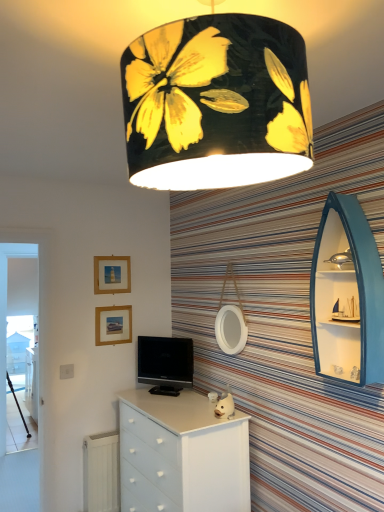
Find the location of a particular element. The height and width of the screenshot is (512, 384). matte gold picture frame at upper left, placed as the 2th picture frame when sorted from bottom to top is located at coordinates (112, 274).

Identify the location of teal wood boat-shaped shelf at right. Image resolution: width=384 pixels, height=512 pixels. point(347,295).

Describe the element at coordinates (113, 325) in the screenshot. I see `wooden picture frame at upper left, positioned as the 1th picture frame in bottom-to-top order` at that location.

You are a GUI agent. You are given a task and a screenshot of the screen. Output one action in this format:
    pyautogui.click(x=<x>, y=<y>)
    Task: Click on the matte gold picture frame at upper left, placed as the 2th picture frame when sorted from bottom to top
    The height and width of the screenshot is (512, 384).
    Given the screenshot: What is the action you would take?
    pyautogui.click(x=112, y=274)

Locate an element on the screen. This screenshot has height=512, width=384. shelf in front of the wooden picture frame at upper left, positioned as the 1th picture frame in bottom-to-top order is located at coordinates (347, 295).

Based on the photo, between wooden picture frame at upper left, which is counted as the second picture frame, starting from the top, and teal wood boat-shaped shelf at right, which one has more height?

teal wood boat-shaped shelf at right.

From the picture: Can you tell me how much wooden picture frame at upper left, which is counted as the second picture frame, starting from the top, and teal wood boat-shaped shelf at right differ in facing direction?

There is a 90.2-degree angle between the facing directions of wooden picture frame at upper left, which is counted as the second picture frame, starting from the top, and teal wood boat-shaped shelf at right.

Are wooden picture frame at upper left, which is counted as the second picture frame, starting from the top, and teal wood boat-shaped shelf at right beside each other?

No, wooden picture frame at upper left, which is counted as the second picture frame, starting from the top, is not with teal wood boat-shaped shelf at right.

Find the location of a particular element. radiator behind the black fabric lampshade at upper center is located at coordinates (101, 472).

Which is more distant, (263,151) or (84,490)?

The point (84,490) is more distant.

What's the angular difference between black fabric lampshade at upper center and white matte radiator at lower left's facing directions?

They differ by 180 degrees in their facing directions.

Is black fabric lampshade at upper center taller than white matte radiator at lower left?

Incorrect, the height of black fabric lampshade at upper center is not larger of that of white matte radiator at lower left.

Who is taller, white matte mirror at center or matte gold picture frame at upper left, placed as the 2th picture frame when sorted from bottom to top?

white matte mirror at center is taller.

From a real-world perspective, which object rests below the other?

→ white matte mirror at center.

Is white matte mirror at center thinner than matte gold picture frame at upper left, placed as the 2th picture frame when sorted from bottom to top?

In fact, white matte mirror at center might be wider than matte gold picture frame at upper left, placed as the 2th picture frame when sorted from bottom to top.

Would you say matte gold picture frame at upper left, placed as the 2th picture frame when sorted from bottom to top, is part of white matte mirror at center's contents?

No, matte gold picture frame at upper left, placed as the 2th picture frame when sorted from bottom to top, is not surrounded by white matte mirror at center.

Considering the sizes of black glossy television at center and black fabric lampshade at upper center in the image, is black glossy television at center wider or thinner than black fabric lampshade at upper center?

In the image, black glossy television at center appears to be more narrow than black fabric lampshade at upper center.

Is black glossy television at center outside of black fabric lampshade at upper center?

Absolutely, black glossy television at center is external to black fabric lampshade at upper center.

Based on the photo, what's the angular difference between black glossy television at center and black fabric lampshade at upper center's facing directions?

There is a 129-degree angle between the facing directions of black glossy television at center and black fabric lampshade at upper center.

Does point (169, 371) lie in front of point (181, 151)?

No.

From a real-world perspective, is wooden picture frame at upper left, positioned as the 1th picture frame in bottom-to-top order, positioned under black glossy television at center based on gravity?

Actually, wooden picture frame at upper left, positioned as the 1th picture frame in bottom-to-top order, is physically above black glossy television at center in the real world.

Considering the positions of point (129, 341) and point (172, 362), is point (129, 341) closer or farther from the camera than point (172, 362)?

Clearly, point (129, 341) is more distant from the camera than point (172, 362).

Which is more to the right, wooden picture frame at upper left, positioned as the 1th picture frame in bottom-to-top order, or black glossy television at center?

black glossy television at center.

Which of these two, wooden picture frame at upper left, positioned as the 1th picture frame in bottom-to-top order, or black glossy television at center, is bigger?

black glossy television at center.

Is teal wood boat-shaped shelf at right thinner than wooden tripod at left?

No, teal wood boat-shaped shelf at right is not thinner than wooden tripod at left.

Is teal wood boat-shaped shelf at right taller or shorter than wooden tripod at left?

Clearly, teal wood boat-shaped shelf at right is taller compared to wooden tripod at left.

From a real-world perspective, is teal wood boat-shaped shelf at right positioned over wooden tripod at left based on gravity?

Yes, from a real-world perspective, teal wood boat-shaped shelf at right is over wooden tripod at left

Measure the distance from teal wood boat-shaped shelf at right to wooden tripod at left.

The distance of teal wood boat-shaped shelf at right from wooden tripod at left is 4.10 meters.

Are white matte mirror at center and black glossy television at center making contact?

They are not placed beside each other.

Is white matte mirror at center to the left of black glossy television at center from the viewer's perspective?

No, white matte mirror at center is not to the left of black glossy television at center.

The image size is (384, 512). Find the location of `oval above the black glossy television at center (from the image's perspective)`. oval above the black glossy television at center (from the image's perspective) is located at coordinates (231, 329).

Is white matte mirror at center further to camera compared to black glossy television at center?

No, the depth of white matte mirror at center is less than that of black glossy television at center.

This screenshot has height=512, width=384. Find the location of `picture frame below the teal wood boat-shaped shelf at right (from a real-world perspective)`. picture frame below the teal wood boat-shaped shelf at right (from a real-world perspective) is located at coordinates click(113, 325).

The image size is (384, 512). Find the location of `radiator to the left of black fabric lampshade at upper center`. radiator to the left of black fabric lampshade at upper center is located at coordinates (101, 472).

Which object lies further to the anchor point white glossy chest of drawers at center, transparent glass screen door at left or wooden tripod at left?

The object further to white glossy chest of drawers at center is wooden tripod at left.

In the scene shown: Estimate the real-world distances between objects in this image. Which object is further from wooden picture frame at upper left, which is counted as the second picture frame, starting from the top, matte gold picture frame at upper left, placed as the 2th picture frame when sorted from bottom to top, or white matte radiator at lower left?

The object further to wooden picture frame at upper left, which is counted as the second picture frame, starting from the top, is white matte radiator at lower left.

From the picture: From the image, which object appears to be farther from black fabric lampshade at upper center, white matte radiator at lower left or black glossy television at center?

The object further to black fabric lampshade at upper center is white matte radiator at lower left.

Looking at this image, estimate the real-world distances between objects in this image. Which object is closer to wooden tripod at left, matte gold picture frame at upper left, the first picture frame in the top-to-bottom sequence, or teal wood boat-shaped shelf at right?

Among the two, matte gold picture frame at upper left, the first picture frame in the top-to-bottom sequence, is located nearer to wooden tripod at left.

Based on their spatial positions, is white matte mirror at center or teal wood boat-shaped shelf at right further from transparent glass screen door at left?

teal wood boat-shaped shelf at right lies further to transparent glass screen door at left than the other object.

Looking at the image, which one is located further to matte gold picture frame at upper left, placed as the 2th picture frame when sorted from bottom to top, wooden tripod at left or white matte mirror at center?

wooden tripod at left is further to matte gold picture frame at upper left, placed as the 2th picture frame when sorted from bottom to top.

Considering their positions, is black fabric lampshade at upper center positioned closer to teal wood boat-shaped shelf at right than wooden picture frame at upper left, positioned as the 1th picture frame in bottom-to-top order?

black fabric lampshade at upper center.

When comparing their distances from matte gold picture frame at upper left, placed as the 2th picture frame when sorted from bottom to top, does black fabric lampshade at upper center or white matte radiator at lower left seem closer?

white matte radiator at lower left is closer to matte gold picture frame at upper left, placed as the 2th picture frame when sorted from bottom to top.

Where is `radiator located between teal wood boat-shaped shelf at right and wooden tripod at left in the depth direction`? radiator located between teal wood boat-shaped shelf at right and wooden tripod at left in the depth direction is located at coordinates (101, 472).

At what (x,y) coordinates should I click in order to perform the action: click on picture frame located between wooden picture frame at upper left, which is counted as the second picture frame, starting from the top, and transparent glass screen door at left in the depth direction. Please return your answer as a coordinate pair (x, y). The width and height of the screenshot is (384, 512). Looking at the image, I should click on (112, 274).

Locate an element on the screen. This screenshot has height=512, width=384. oval that lies between teal wood boat-shaped shelf at right and white glossy chest of drawers at center from top to bottom is located at coordinates (231, 329).

At what (x,y) coordinates should I click in order to perform the action: click on television between black fabric lampshade at upper center and wooden picture frame at upper left, positioned as the 1th picture frame in bottom-to-top order, along the z-axis. Please return your answer as a coordinate pair (x, y). Looking at the image, I should click on (166, 362).